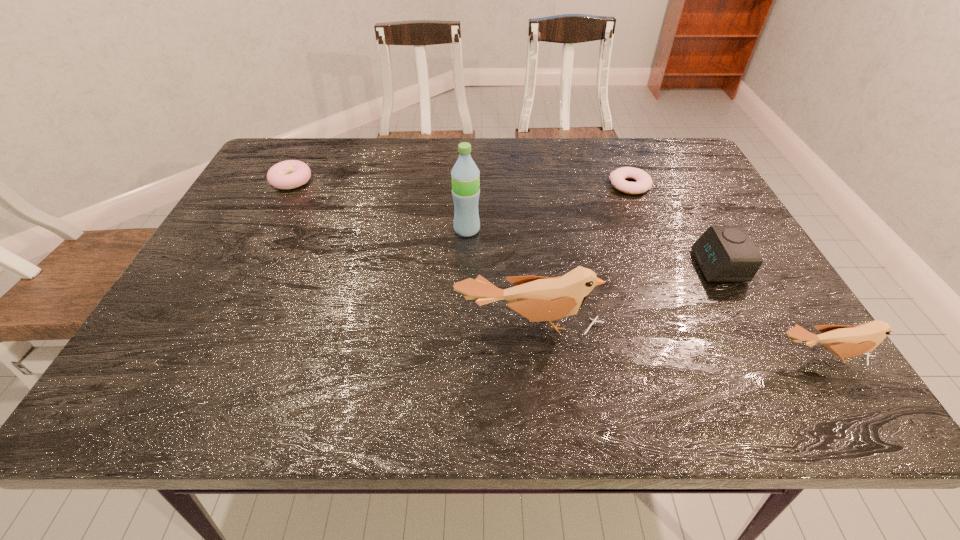
Locate an element on the screen. The height and width of the screenshot is (540, 960). vacant area that lies between the right bird and the taller bird is located at coordinates pyautogui.click(x=675, y=341).

Identify the location of vacant region between the tallest object and the fourth shortest object. (644, 293).

What are the coordinates of `free spot between the water bottle and the taller doughnut` in the screenshot? It's located at (379, 205).

The width and height of the screenshot is (960, 540). Identify the location of vacant space that's between the leftmost object and the fourth nearest object. (379, 205).

At what (x,y) coordinates should I click in order to perform the action: click on vacant area between the shorter doughnut and the third nearest object. Please return your answer as a coordinate pair (x, y). Looking at the image, I should click on (674, 225).

Identify the location of vacant area between the tallest object and the nearer bird. (644, 293).

Identify the location of unoccupied position between the second tallest object and the fifth tallest object. (410, 252).

In order to click on free area in between the second shortest object and the second nearest object in this screenshot , I will do `click(410, 252)`.

What are the coordinates of `free spot between the leftmost object and the alarm clock` in the screenshot? It's located at (505, 223).

What are the coordinates of `the closest object to the right bird` in the screenshot? It's located at (724, 253).